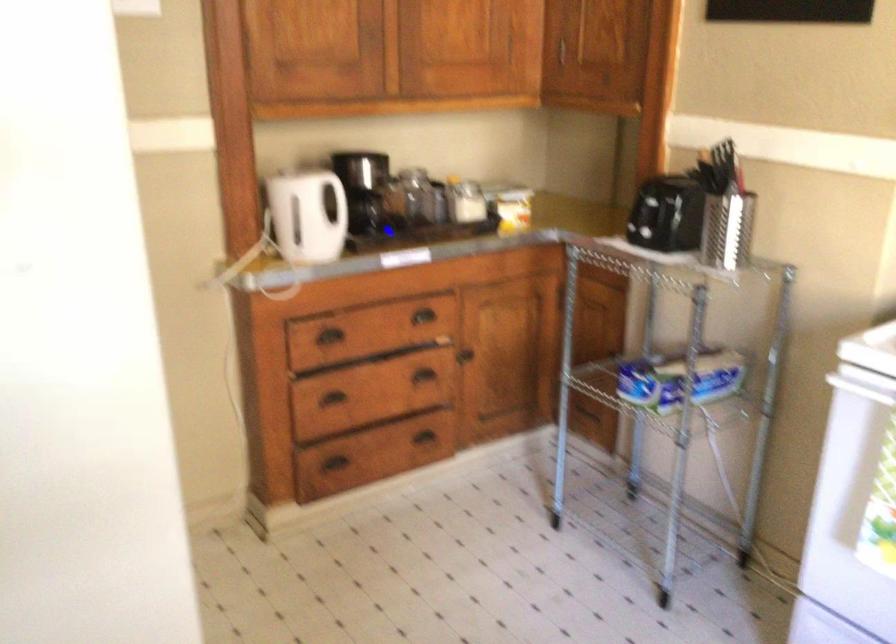
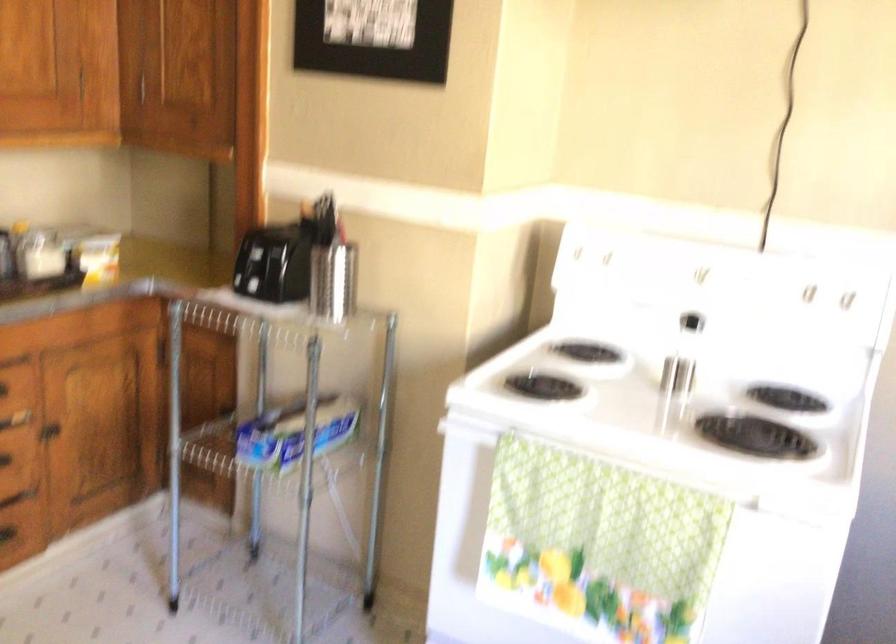
Where in the second image is the point corresponding to point (670, 377) from the first image?

(295, 433)